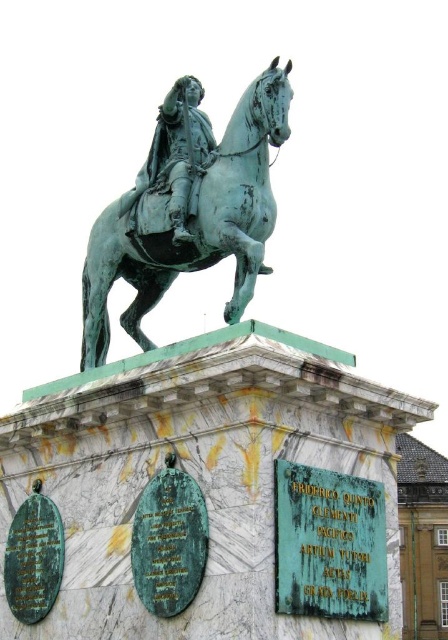
Question: Can you confirm if green patina horse at center is bigger than green patina statue at center?

Choices:
 (A) no
 (B) yes

Answer: (B)

Question: Can you confirm if green patina horse at center is positioned below green patina statue at center?

Choices:
 (A) no
 (B) yes

Answer: (B)

Question: Which object appears farthest from the camera in this image?

Choices:
 (A) green patina horse at center
 (B) green patina statue at center

Answer: (B)

Question: Which point is farther to the camera?

Choices:
 (A) (106, 284)
 (B) (194, 193)

Answer: (A)

Question: Which point is farther to the camera?

Choices:
 (A) green patina statue at center
 (B) green patina horse at center

Answer: (A)

Question: Can you confirm if green patina horse at center is bigger than green patina statue at center?

Choices:
 (A) no
 (B) yes

Answer: (B)